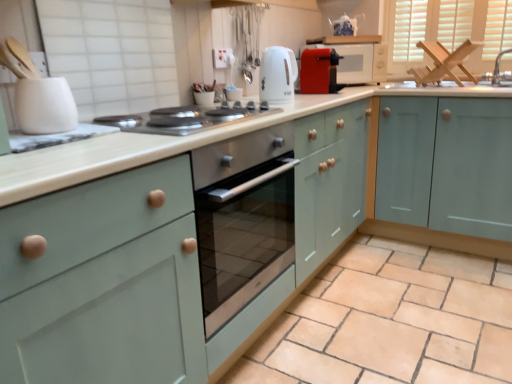
At what (x,y) coordinates should I click in order to perform the action: click on matte gray tile at center. Please return your answer as a coordinate pair (x, y). Looking at the image, I should click on (391, 321).

How much space does matte red toaster at upper center, acting as the 3th kitchen appliance starting from the bottom, occupy horizontally?

11.70 inches.

What do you see at coordinates (413, 225) in the screenshot?
I see `teal matte cabinet at right` at bounding box center [413, 225].

In order to click on matte red microwave at upper right in this screenshot , I will do `click(358, 62)`.

Measure the distance between point (323, 44) and camera.

8.00 feet.

Find the location of a particular element. matte gray tile at center is located at coordinates click(391, 321).

Considering the relative positions of matte gray tile at center and wooden frame at upper right in the image provided, is matte gray tile at center to the left or to the right of wooden frame at upper right?

matte gray tile at center is positioned on wooden frame at upper right's left side.

In the image, is matte gray tile at center positioned in front of or behind wooden frame at upper right?

matte gray tile at center is positioned closer to the viewer than wooden frame at upper right.

Is matte gray tile at center positioned with its back to wooden frame at upper right?

No, wooden frame at upper right is not at the back of matte gray tile at center.

Find the location of `tile in front of the wooden frame at upper right`. tile in front of the wooden frame at upper right is located at coordinates (391, 321).

Which is nearer, (381, 68) or (309, 60)?

Positioned in front is point (309, 60).

Is matte red microwave at upper right spatially inside matte red toaster at upper center, which is the first kitchen appliance in right-to-left order, or outside of it?

matte red microwave at upper right lies outside matte red toaster at upper center, which is the first kitchen appliance in right-to-left order.

From the picture: Can you confirm if matte red microwave at upper right is thinner than matte red toaster at upper center, which appears as the 1th kitchen appliance when viewed from the back?

→ In fact, matte red microwave at upper right might be wider than matte red toaster at upper center, which appears as the 1th kitchen appliance when viewed from the back.

Is point (157, 133) farther from viewer compared to point (307, 61)?

No, it is in front of (307, 61).

How different are the orientations of stainless steel cooktop at center and matte red toaster at upper center, which is the 3th kitchen appliance from left to right, in degrees?

There is a 0.71-degree angle between the facing directions of stainless steel cooktop at center and matte red toaster at upper center, which is the 3th kitchen appliance from left to right.

From a real-world perspective, is stainless steel cooktop at center below matte red toaster at upper center, which is the first kitchen appliance in right-to-left order?

Indeed, from a real-world perspective, stainless steel cooktop at center is positioned beneath matte red toaster at upper center, which is the first kitchen appliance in right-to-left order.

Based on the photo, which object is further away from the camera taking this photo, teal matte cabinet at right or matte red microwave at upper right?

matte red microwave at upper right is further from the camera.

From a real-world perspective, who is located lower, teal matte cabinet at right or matte red microwave at upper right?

teal matte cabinet at right.

Considering the sizes of objects teal matte cabinet at right and matte red microwave at upper right in the image provided, who is bigger, teal matte cabinet at right or matte red microwave at upper right?

Bigger between the two is teal matte cabinet at right.

Would you say wooden frame at upper right is to the left or to the right of teal matte cabinet at right in the picture?

In the image, wooden frame at upper right appears on the right side of teal matte cabinet at right.

Is wooden frame at upper right not close to teal matte cabinet at right?

That's not correct — wooden frame at upper right is a little close to teal matte cabinet at right.

Looking at this image, considering the relative sizes of wooden frame at upper right and teal matte cabinet at right in the image provided, is wooden frame at upper right wider than teal matte cabinet at right?

Incorrect, the width of wooden frame at upper right does not surpass that of teal matte cabinet at right.

Is wooden frame at upper right facing towards teal matte cabinet at right?

No.

Is wooden frame at upper right looking in the opposite direction of white matte cup at upper left, acting as the third kitchen appliance starting from the right?

wooden frame at upper right is not turned away from white matte cup at upper left, acting as the third kitchen appliance starting from the right.

Is wooden frame at upper right wider or thinner than white matte cup at upper left, placed as the third kitchen appliance when sorted from back to front?

Considering their sizes, wooden frame at upper right looks slimmer than white matte cup at upper left, placed as the third kitchen appliance when sorted from back to front.

From a real-world perspective, between wooden frame at upper right and white matte cup at upper left, acting as the 1th kitchen appliance starting from the left, who is vertically lower?

white matte cup at upper left, acting as the 1th kitchen appliance starting from the left.

Which is more to the right, wooden frame at upper right or white matte cup at upper left, acting as the third kitchen appliance starting from the right?

wooden frame at upper right is more to the right.

From the picture: Is white glossy electric kettle at upper center, the second kitchen appliance in the front-to-back sequence, at the back of white matte cup at upper left, acting as the third kitchen appliance starting from the right?

white matte cup at upper left, acting as the third kitchen appliance starting from the right, does not have its back to white glossy electric kettle at upper center, the second kitchen appliance in the front-to-back sequence.

From a real-world perspective, is white matte cup at upper left, acting as the third kitchen appliance starting from the right, over white glossy electric kettle at upper center, the second kitchen appliance viewed from the left?

No, from a real-world perspective, white matte cup at upper left, acting as the third kitchen appliance starting from the right, is not on top of white glossy electric kettle at upper center, the second kitchen appliance viewed from the left.

Is white matte cup at upper left, acting as the 1th kitchen appliance starting from the left, spatially inside white glossy electric kettle at upper center, the 2th kitchen appliance in the back-to-front sequence, or outside of it?

white matte cup at upper left, acting as the 1th kitchen appliance starting from the left, exists outside the volume of white glossy electric kettle at upper center, the 2th kitchen appliance in the back-to-front sequence.

Is point (44, 102) behind point (286, 79)?

No, it is not.

At what (x,y) coordinates should I click in order to perform the action: click on window above the matte gray tile at center (from the image's perspective). Please return your answer as a coordinate pair (x, y). Looking at the image, I should click on (449, 30).

Locate an element on the screen. This screenshot has height=384, width=512. microwave located above the matte red toaster at upper center, which appears as the 1th kitchen appliance when viewed from the back (from a real-world perspective) is located at coordinates (358, 62).

In the scene shown: Based on their spatial positions, is teal matte cabinet at right or matte gray tile at center further from white matte cup at upper left, marked as the first kitchen appliance in a bottom-to-top arrangement?

teal matte cabinet at right.

Considering their positions, is wooden frame at upper right positioned further to blue and white porcelain tea pot at upper center than teal matte cabinet at right?

teal matte cabinet at right lies further to blue and white porcelain tea pot at upper center than the other object.

Based on their spatial positions, is stainless steel cooktop at center or silver metallic faucet at upper right closer to white matte cup at upper left, marked as the first kitchen appliance in a bottom-to-top arrangement?

stainless steel cooktop at center is closer to white matte cup at upper left, marked as the first kitchen appliance in a bottom-to-top arrangement.

Which object lies further to the anchor point matte gray tile at center, stainless steel cooktop at center or white glossy electric kettle at upper center, which appears as the second kitchen appliance when viewed from the right?

white glossy electric kettle at upper center, which appears as the second kitchen appliance when viewed from the right, lies further to matte gray tile at center than the other object.

Which object lies further to the anchor point matte red toaster at upper center, which is the 3th kitchen appliance from left to right, white glossy electric kettle at upper center, which appears as the second kitchen appliance when viewed from the right, or matte gray tile at center?

Among the two, matte gray tile at center is located further to matte red toaster at upper center, which is the 3th kitchen appliance from left to right.

When comparing their distances from matte gray tile at center, does white matte cup at upper left, placed as the third kitchen appliance when sorted from back to front, or blue and white porcelain tea pot at upper center seem further?

The object further to matte gray tile at center is blue and white porcelain tea pot at upper center.

Considering their positions, is wooden frame at upper right positioned closer to matte red toaster at upper center, which is the first kitchen appliance in top-to-bottom order, than white glossy electric kettle at upper center, which appears as the second kitchen appliance when viewed from the right?

white glossy electric kettle at upper center, which appears as the second kitchen appliance when viewed from the right.

Based on their spatial positions, is white matte cup at upper left, acting as the third kitchen appliance starting from the right, or stainless steel cooktop at center closer to blue and white porcelain tea pot at upper center?

stainless steel cooktop at center is closer to blue and white porcelain tea pot at upper center.

Locate an element on the screen. The height and width of the screenshot is (384, 512). faucet between matte gray tile at center and blue and white porcelain tea pot at upper center along the z-axis is located at coordinates (498, 67).

Where is `home appliance between white matte cup at upper left, the 3th kitchen appliance positioned from the top, and matte red microwave at upper right in the front-back direction`? This screenshot has height=384, width=512. home appliance between white matte cup at upper left, the 3th kitchen appliance positioned from the top, and matte red microwave at upper right in the front-back direction is located at coordinates (185, 119).

Locate an element on the screen. This screenshot has width=512, height=384. window between matte red toaster at upper center, which is the first kitchen appliance in right-to-left order, and silver metallic faucet at upper right from left to right is located at coordinates (449, 30).

Identify the location of tea pot between white matte cup at upper left, the 3th kitchen appliance positioned from the top, and teal matte cabinet at right from left to right. The width and height of the screenshot is (512, 384). (346, 25).